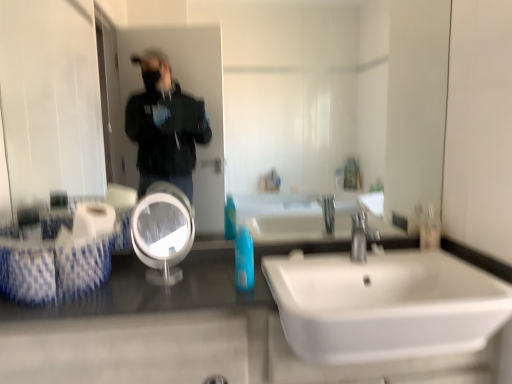
I want to click on vacant area situated to the left side of clear plastic bottle at right, which is counted as the second mouthwash, starting from the left, so click(x=395, y=251).